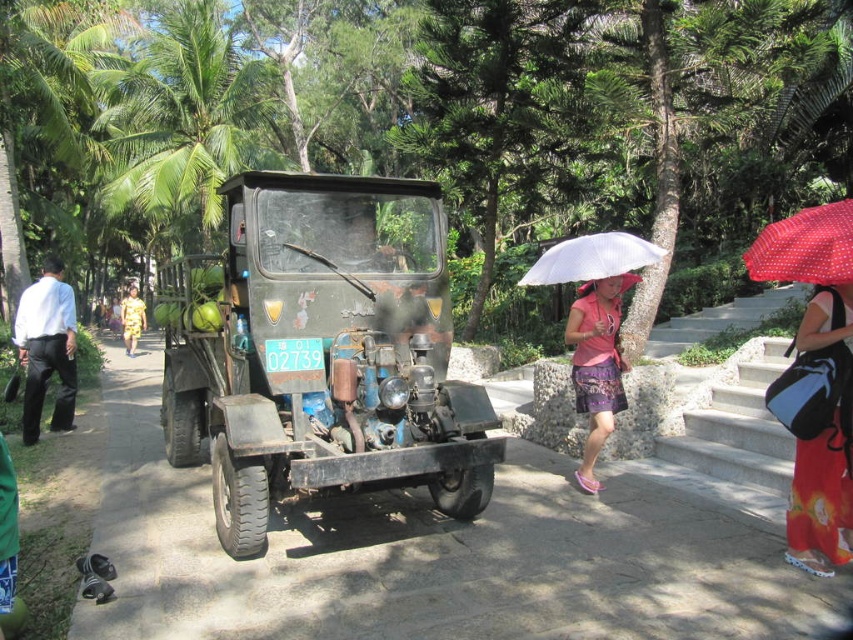
Can you confirm if white shirt at left is positioned to the left of white matte umbrella at center?

Indeed, white shirt at left is positioned on the left side of white matte umbrella at center.

You are a GUI agent. You are given a task and a screenshot of the screen. Output one action in this format:
    pyautogui.click(x=<x>, y=<y>)
    Task: Click on the white shirt at left
    
    Given the screenshot: What is the action you would take?
    pyautogui.click(x=45, y=348)

Which is more to the right, floral cotton skirt at lower right or white shirt at left?

floral cotton skirt at lower right

Does floral cotton skirt at lower right have a larger size compared to white shirt at left?

Incorrect, floral cotton skirt at lower right is not larger than white shirt at left.

In order to click on floral cotton skirt at lower right in this screenshot , I will do `click(822, 497)`.

Is green leafy palm tree at upper left further to camera compared to yellow floral dress at center?

Yes.

Who is more distant from viewer, (254, 97) or (131, 352)?

The point (254, 97) is behind.

This screenshot has width=853, height=640. Describe the element at coordinates (183, 118) in the screenshot. I see `green leafy palm tree at upper left` at that location.

Find the location of a particular element. Image resolution: width=853 pixels, height=640 pixels. green leafy palm tree at upper left is located at coordinates (183, 118).